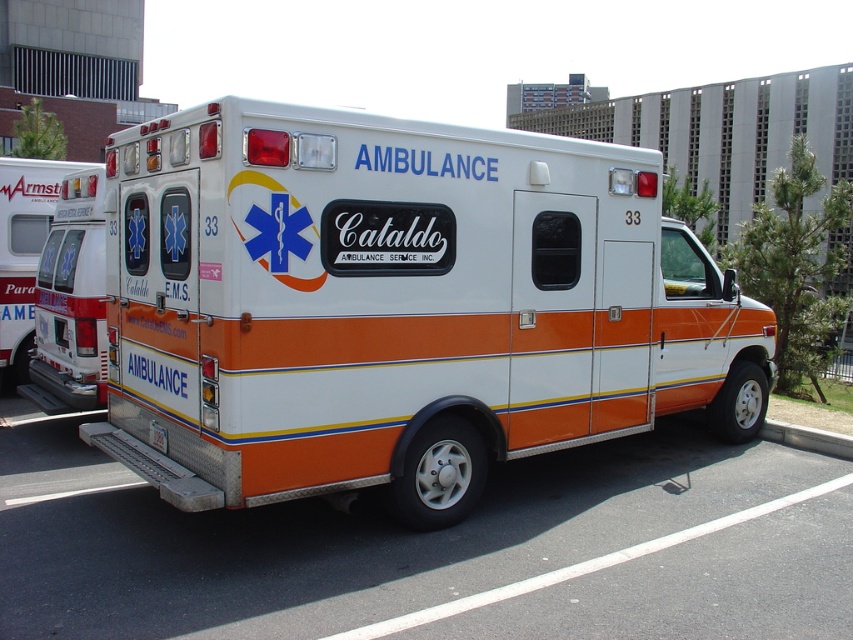
Question: In this image, where is white glossy ambulance at center located relative to white asphalt at lower center?

Choices:
 (A) above
 (B) below

Answer: (A)

Question: Does white glossy ambulance at center appear over gray concrete curb at lower right?

Choices:
 (A) no
 (B) yes

Answer: (B)

Question: Which point is farther from the camera taking this photo?

Choices:
 (A) (148, 576)
 (B) (161, 448)
 (C) (764, 422)
 (D) (650, 310)

Answer: (C)

Question: Is gray concrete curb at lower right wider than white plastic license plate at lower center?

Choices:
 (A) no
 (B) yes

Answer: (B)

Question: Which of the following is the closest to the observer?

Choices:
 (A) gray concrete curb at lower right
 (B) white plastic license plate at lower center
 (C) white glossy ambulance at center

Answer: (C)

Question: Among these points, which one is farthest from the camera?

Choices:
 (A) (837, 628)
 (B) (160, 435)
 (C) (457, 128)

Answer: (B)